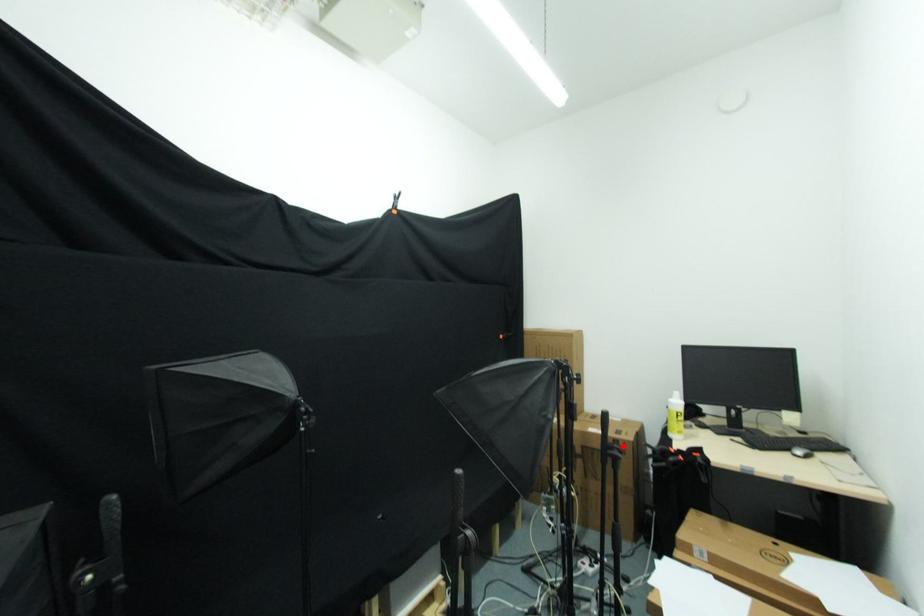
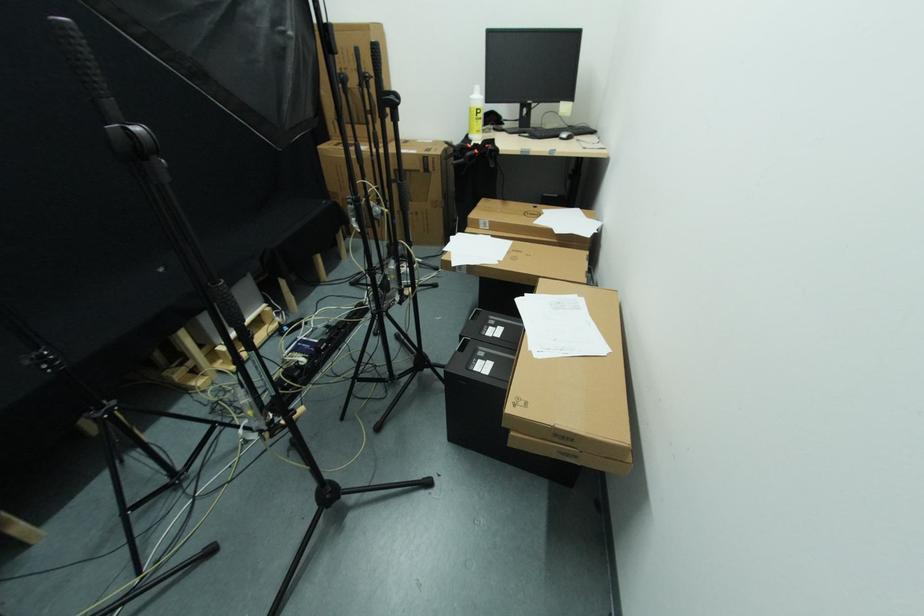
Question: I am providing you with two images of the same scene from different viewpoints. Given a red point in image1, look at the same physical point in image2. Is it:

Choices:
 (A) Closer to the viewpoint
 (B) Farther from the viewpoint

Answer: (A)